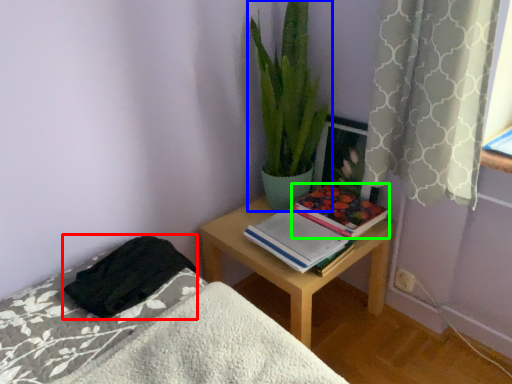
Question: Based on their relative distances, which object is nearer to blanket (highlighted by a red box)? Choose from houseplant (highlighted by a blue box) and paperback book (highlighted by a green box).

Choices:
 (A) houseplant
 (B) paperback book

Answer: (B)